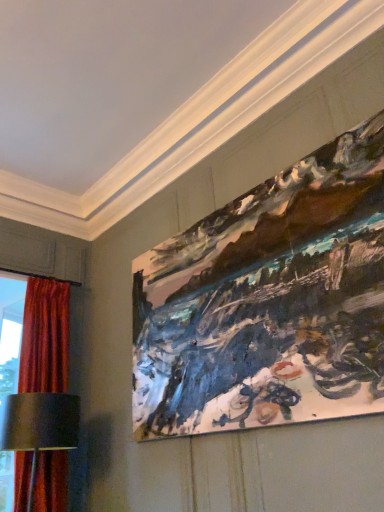
You are a GUI agent. You are given a task and a screenshot of the screen. Output one action in this format:
    pyautogui.click(x=<x>, y=<y>)
    Task: Click on the velvet red curtain at left
    Image resolution: width=384 pixels, height=512 pixels.
    Given the screenshot: What is the action you would take?
    pyautogui.click(x=45, y=336)

At what (x,y) coordinates should I click in order to perform the action: click on painted canvas at upper right. Please return your answer as a coordinate pair (x, y). The width and height of the screenshot is (384, 512). Looking at the image, I should click on (269, 302).

Is velvet red curtain at left bigger than metallic silver table lamp at lower left?

Correct, velvet red curtain at left is larger in size than metallic silver table lamp at lower left.

Can you confirm if velvet red curtain at left is shorter than metallic silver table lamp at lower left?

No.

Between point (55, 349) and point (17, 400), which one is positioned in front?

The point (17, 400) is closer to the camera.

Does painted canvas at upper right contain metallic silver table lamp at lower left?

No, painted canvas at upper right does not contain metallic silver table lamp at lower left.

From the image's perspective, relative to metallic silver table lamp at lower left, is painted canvas at upper right above or below?

painted canvas at upper right is situated higher than metallic silver table lamp at lower left in the image.

Is painted canvas at upper right aimed at metallic silver table lamp at lower left?

No, painted canvas at upper right is not turned towards metallic silver table lamp at lower left.

Identify the location of curtain on the left of metallic silver table lamp at lower left. (45, 336).

From the image's perspective, is metallic silver table lamp at lower left located above or below velvet red curtain at left?

Based on their image positions, metallic silver table lamp at lower left is located beneath velvet red curtain at left.

Does point (18, 409) appear closer or farther from the camera than point (43, 380)?

Point (18, 409).

You are a GUI agent. You are given a task and a screenshot of the screen. Output one action in this format:
    pyautogui.click(x=<x>, y=<y>)
    Task: Click on the table lamp below the painted canvas at upper right (from the image's perspective)
    This screenshot has height=512, width=384.
    Given the screenshot: What is the action you would take?
    pyautogui.click(x=39, y=426)

From the image's perspective, is metallic silver table lamp at lower left positioned above or below painted canvas at upper right?

metallic silver table lamp at lower left is below painted canvas at upper right.

From a real-world perspective, is metallic silver table lamp at lower left physically located above or below painted canvas at upper right?

Clearly, from a real-world perspective, metallic silver table lamp at lower left is below painted canvas at upper right.

Identify the location of picture frame to the right of velvet red curtain at left. This screenshot has width=384, height=512. (269, 302).

Is painted canvas at upper right taller or shorter than velvet red curtain at left?

In the image, painted canvas at upper right appears to be shorter than velvet red curtain at left.

Is painted canvas at upper right not close to velvet red curtain at left?

That's right, there is a large distance between painted canvas at upper right and velvet red curtain at left.

Considering the sizes of objects velvet red curtain at left and painted canvas at upper right in the image provided, who is bigger, velvet red curtain at left or painted canvas at upper right?

With larger size is velvet red curtain at left.

From a real-world perspective, which object rests below the other?

velvet red curtain at left, from a real-world perspective.

Is point (50, 477) closer or farther from the camera than point (162, 352)?

Clearly, point (50, 477) is closer to the camera than point (162, 352).

From the image's perspective, relative to painted canvas at upper right, is velvet red curtain at left above or below?

velvet red curtain at left is situated lower than painted canvas at upper right in the image.

Locate an element on the screen. The image size is (384, 512). curtain behind the metallic silver table lamp at lower left is located at coordinates (45, 336).

The height and width of the screenshot is (512, 384). Find the location of `picture frame in front of the metallic silver table lamp at lower left`. picture frame in front of the metallic silver table lamp at lower left is located at coordinates (269, 302).

Which object lies nearer to the anchor point painted canvas at upper right, velvet red curtain at left or metallic silver table lamp at lower left?

metallic silver table lamp at lower left lies closer to painted canvas at upper right than the other object.

From the image, which object appears to be farther from metallic silver table lamp at lower left, painted canvas at upper right or velvet red curtain at left?

painted canvas at upper right is further to metallic silver table lamp at lower left.

From the image, which object appears to be nearer to velvet red curtain at left, painted canvas at upper right or metallic silver table lamp at lower left?

Among the two, metallic silver table lamp at lower left is located nearer to velvet red curtain at left.

Considering their positions, is metallic silver table lamp at lower left positioned further to painted canvas at upper right than velvet red curtain at left?

velvet red curtain at left.

Which object lies nearer to the anchor point velvet red curtain at left, metallic silver table lamp at lower left or painted canvas at upper right?

metallic silver table lamp at lower left is closer to velvet red curtain at left.

Which object lies nearer to the anchor point metallic silver table lamp at lower left, velvet red curtain at left or painted canvas at upper right?

velvet red curtain at left.

At what (x,y) coordinates should I click in order to perform the action: click on table lamp between velvet red curtain at left and painted canvas at upper right. Please return your answer as a coordinate pair (x, y). Image resolution: width=384 pixels, height=512 pixels. Looking at the image, I should click on (39, 426).